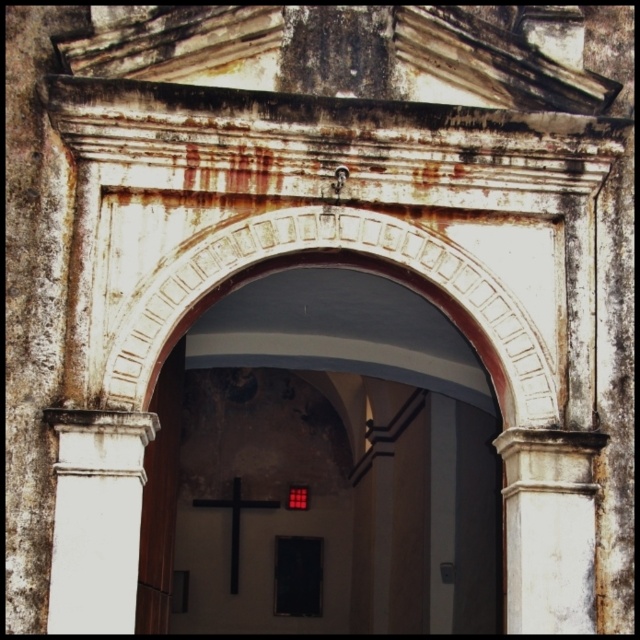
Question: Is white smooth column at left to the left of white stone column at right from the viewer's perspective?

Choices:
 (A) yes
 (B) no

Answer: (A)

Question: Does white smooth column at left appear over white stone column at right?

Choices:
 (A) yes
 (B) no

Answer: (B)

Question: Which point is closer to the camera?

Choices:
 (A) (513, 513)
 (B) (92, 561)

Answer: (B)

Question: Observing the image, what is the correct spatial positioning of white smooth column at left in reference to white stone column at right?

Choices:
 (A) right
 (B) left

Answer: (B)

Question: Which object appears closest to the camera in this image?

Choices:
 (A) white smooth column at left
 (B) white stone column at right

Answer: (A)